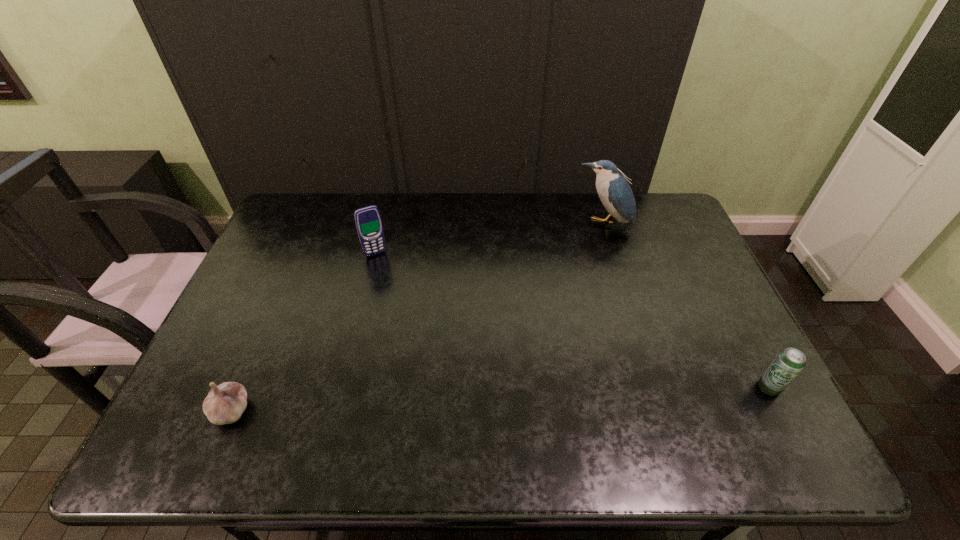
This screenshot has height=540, width=960. In order to click on garlic in this screenshot , I will do `click(225, 403)`.

Locate an element on the screen. The image size is (960, 540). the rightmost object is located at coordinates (789, 362).

You are a GUI agent. You are given a task and a screenshot of the screen. Output one action in this format:
    pyautogui.click(x=<x>, y=<y>)
    Task: Click on the third shortest object
    
    Given the screenshot: What is the action you would take?
    pyautogui.click(x=368, y=221)

The height and width of the screenshot is (540, 960). Find the location of `the second object from left to right`. the second object from left to right is located at coordinates (368, 221).

Where is `the third object from left to right`? The width and height of the screenshot is (960, 540). the third object from left to right is located at coordinates (615, 193).

You are a GUI agent. You are given a task and a screenshot of the screen. Output one action in this format:
    pyautogui.click(x=<x>, y=<y>)
    Task: Click on the farthest object
    
    Given the screenshot: What is the action you would take?
    pyautogui.click(x=615, y=193)

Where is `vacant point located on the back of the leftmost object`? vacant point located on the back of the leftmost object is located at coordinates (251, 366).

Locate an element on the screen. free location located 0.090m on the left of the beer can is located at coordinates (721, 387).

The width and height of the screenshot is (960, 540). What are the coordinates of `vacant space situated on the front-facing side of the third object from right to left` in the screenshot? It's located at (404, 307).

Where is `vacant area located on the front-facing side of the third object from right to left`? This screenshot has height=540, width=960. vacant area located on the front-facing side of the third object from right to left is located at coordinates (404, 307).